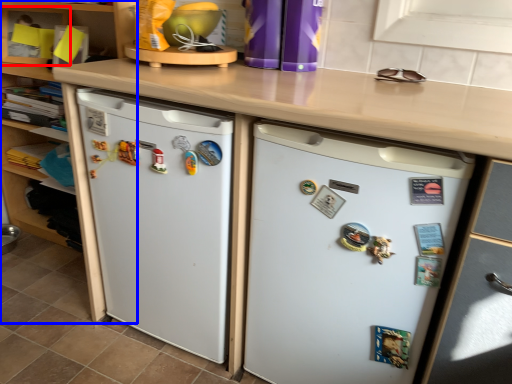
Question: Which point is further to the camera, shelf (highlighted by a red box) or cabinetry (highlighted by a blue box)?

Choices:
 (A) shelf
 (B) cabinetry

Answer: (A)